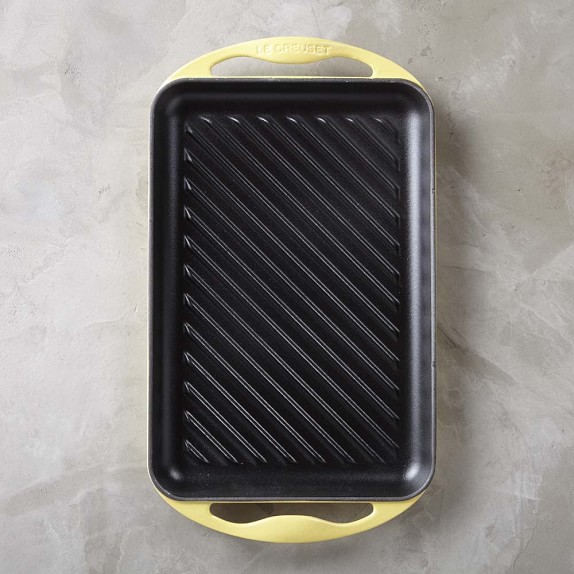
Identify the location of griddle. (325, 397).